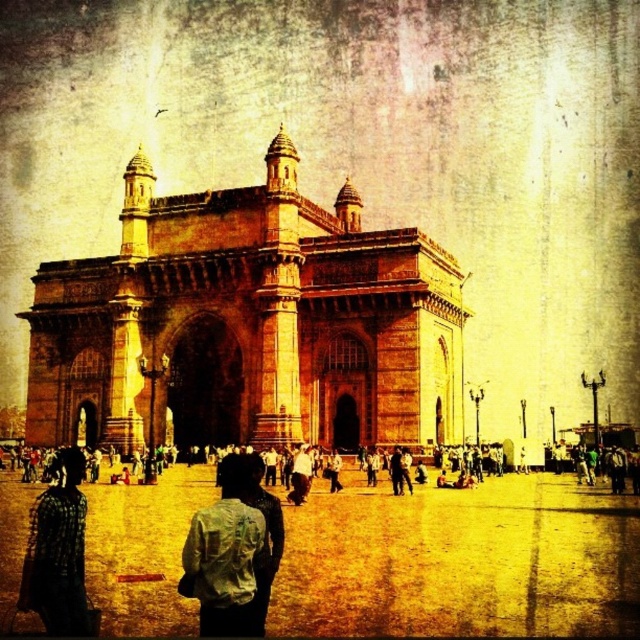
Identify the location of brown stone gateway of india at center. (248, 324).

Between brown stone gateway of india at center and light blue fabric shirt at center, which one appears on the left side from the viewer's perspective?

brown stone gateway of india at center

Describe the element at coordinates (248, 324) in the screenshot. I see `brown stone gateway of india at center` at that location.

I want to click on brown stone gateway of india at center, so click(248, 324).

Is brown stone gateway of india at center positioned in front of checkered fabric shirt at lower left?

That is False.

Is point (36, 436) in front of point (48, 593)?

That is False.

At what (x,y) coordinates should I click in order to perform the action: click on brown stone gateway of india at center. Please return your answer as a coordinate pair (x, y). This screenshot has width=640, height=640. Looking at the image, I should click on (248, 324).

Does brown stone gateway of india at center have a lesser height compared to white cotton shirt at center?

Incorrect, brown stone gateway of india at center's height does not fall short of white cotton shirt at center's.

This screenshot has height=640, width=640. Describe the element at coordinates (248, 324) in the screenshot. I see `brown stone gateway of india at center` at that location.

Find the location of a particular element. The width and height of the screenshot is (640, 640). brown stone gateway of india at center is located at coordinates (248, 324).